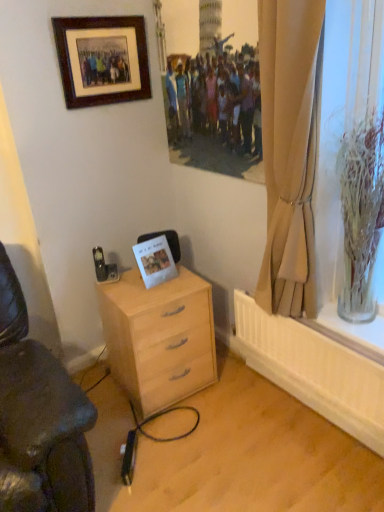
The height and width of the screenshot is (512, 384). In order to click on vacant area that is in front of white paper postcard at center in this screenshot , I will do `click(152, 306)`.